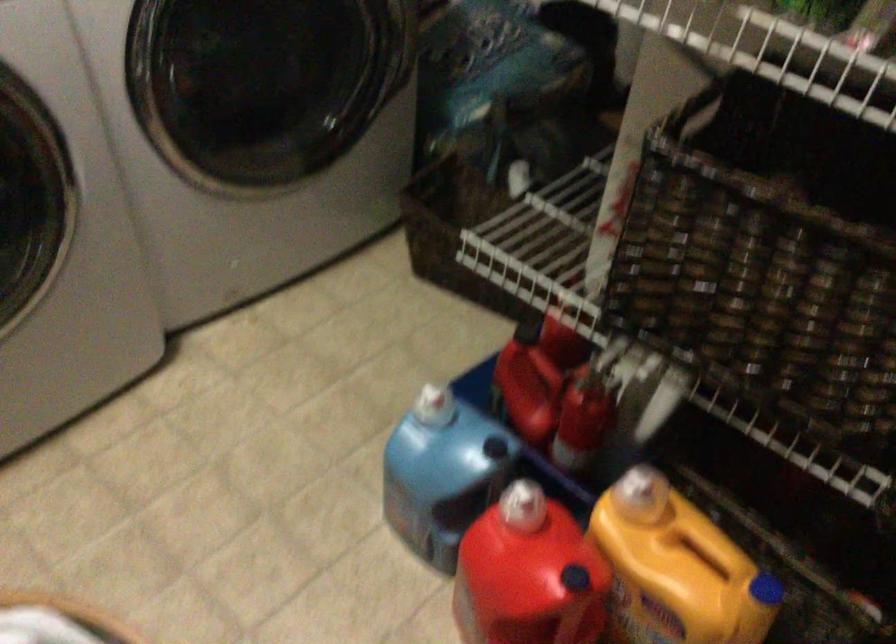
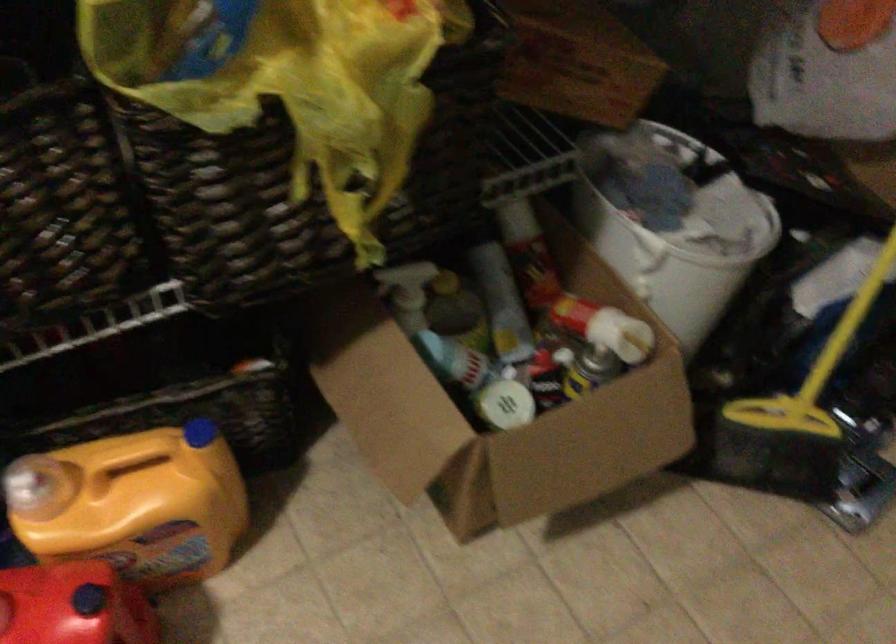
Question: I am providing you with two images of the same scene from different viewpoints. Please identify which objects are invisible in image2.

Choices:
 (A) red container handle
 (B) spray bottle trigger
 (C) detergent jug handle
 (D) none of these

Answer: (D)